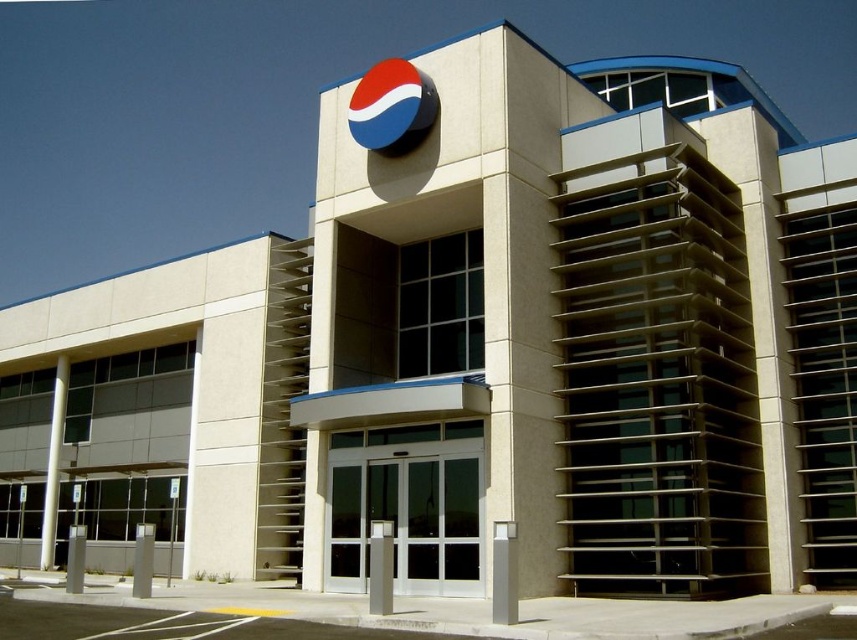
Based on the photo, between white glossy pillar at center and satin silver post at center, which one is positioned higher?

white glossy pillar at center

Does white glossy pillar at center appear on the right side of satin silver post at center?

Indeed, white glossy pillar at center is positioned on the right side of satin silver post at center.

Identify the location of white glossy pillar at center. This screenshot has width=857, height=640. (504, 572).

Can you confirm if white smooth pillar at left is wider than white concrete pillar at lower left?

In fact, white smooth pillar at left might be narrower than white concrete pillar at lower left.

What do you see at coordinates (52, 464) in the screenshot? I see `white smooth pillar at left` at bounding box center [52, 464].

The image size is (857, 640). Identify the location of white smooth pillar at left. (52, 464).

The width and height of the screenshot is (857, 640). I want to click on white smooth pillar at left, so click(x=52, y=464).

This screenshot has width=857, height=640. What do you see at coordinates (52, 464) in the screenshot?
I see `white smooth pillar at left` at bounding box center [52, 464].

From the picture: Is the position of white smooth pillar at left more distant than that of satin silver post at center?

Yes, white smooth pillar at left is further from the viewer.

Between point (49, 440) and point (381, 595), which one is positioned in front?

Point (381, 595)

Where is `white smooth pillar at left`? The image size is (857, 640). white smooth pillar at left is located at coordinates (52, 464).